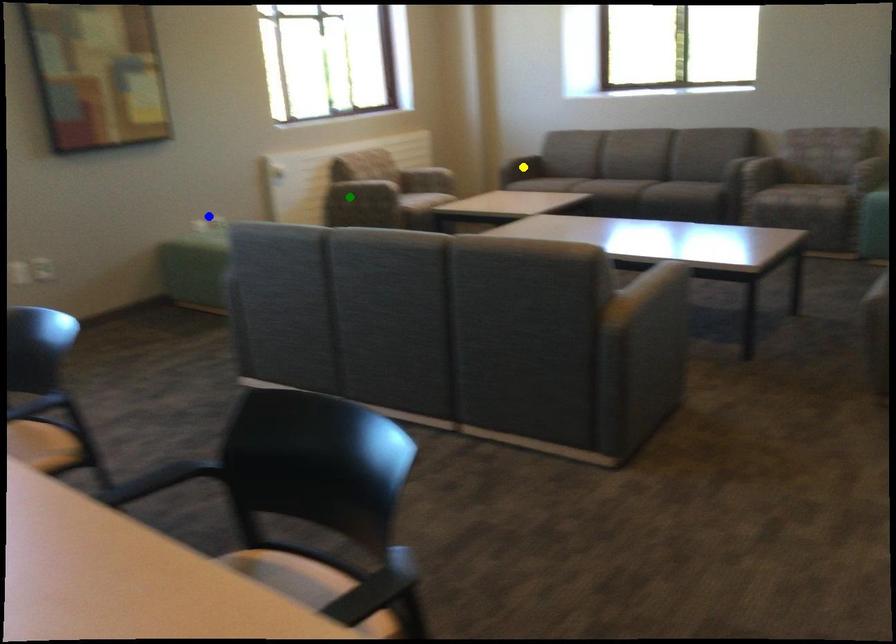
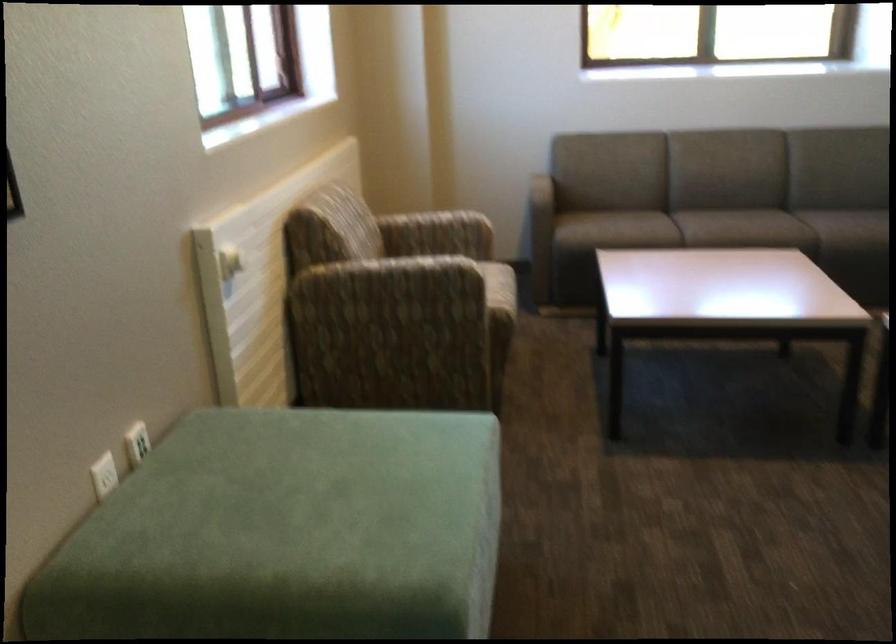
I am providing you with two images of the same scene from different viewpoints. Three points are marked in image1. Which point corresponds to a part or object that is occluded in image2?In image1, three points are marked. Which of them correspond to a part or object that is occluded in image2?Among the three points shown in image1, which one corresponds to a part or object that is no longer visible due to occlusion in image2?

yellow point